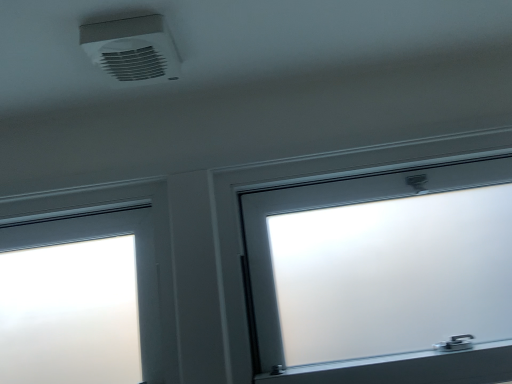
Question: From a real-world perspective, is white plastic air conditioning at upper center above or below frosted glass window at center?

Choices:
 (A) below
 (B) above

Answer: (B)

Question: Visually, is white plastic air conditioning at upper center positioned to the left or to the right of frosted glass window at center?

Choices:
 (A) left
 (B) right

Answer: (A)

Question: In terms of height, does white plastic air conditioning at upper center look taller or shorter compared to frosted glass window at center?

Choices:
 (A) tall
 (B) short

Answer: (B)

Question: From a real-world perspective, relative to white plastic air conditioning at upper center, is frosted glass window at center vertically above or below?

Choices:
 (A) above
 (B) below

Answer: (B)

Question: Considering the positions of frosted glass window at center and white plastic air conditioning at upper center in the image, is frosted glass window at center taller or shorter than white plastic air conditioning at upper center?

Choices:
 (A) tall
 (B) short

Answer: (A)

Question: Is frosted glass window at center spatially inside white plastic air conditioning at upper center, or outside of it?

Choices:
 (A) inside
 (B) outside

Answer: (B)

Question: In the image, is frosted glass window at center on the left side or the right side of white plastic air conditioning at upper center?

Choices:
 (A) left
 (B) right

Answer: (B)